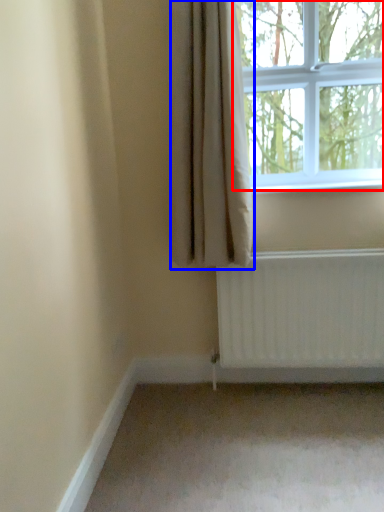
Question: Which point is further to the camera, window (highlighted by a red box) or curtain (highlighted by a blue box)?

Choices:
 (A) window
 (B) curtain

Answer: (A)